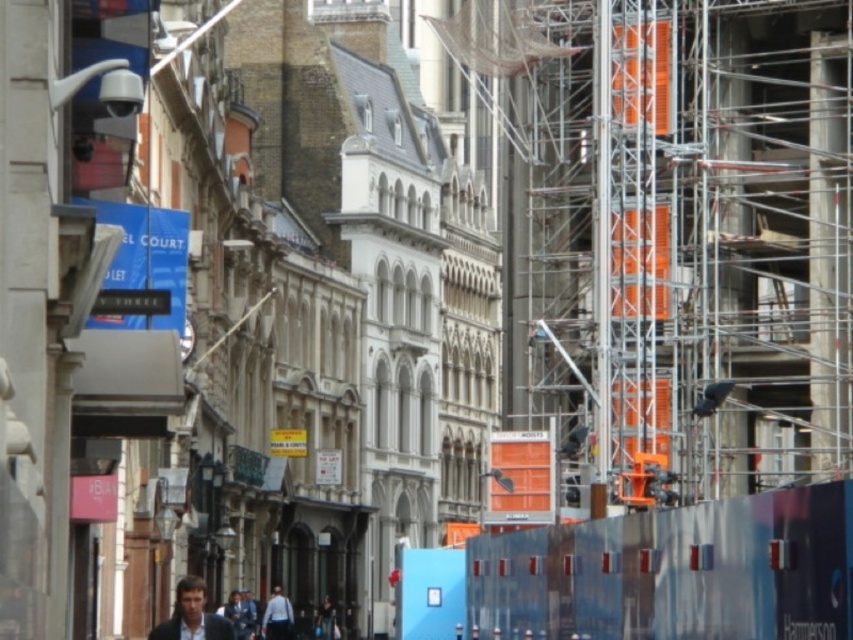
Which is more to the right, light brown leather jacket at lower center or light blue shirt at lower center?

From the viewer's perspective, light blue shirt at lower center appears more on the right side.

Is light brown leather jacket at lower center further to the viewer compared to light blue shirt at lower center?

No, it is in front of light blue shirt at lower center.

Between point (196, 620) and point (289, 608), which one is positioned in front?

Positioned in front is point (196, 620).

You are a GUI agent. You are given a task and a screenshot of the screen. Output one action in this format:
    pyautogui.click(x=<x>, y=<y>)
    Task: Click on the light brown leather jacket at lower center
    Image resolution: width=853 pixels, height=640 pixels.
    Given the screenshot: What is the action you would take?
    pyautogui.click(x=192, y=616)